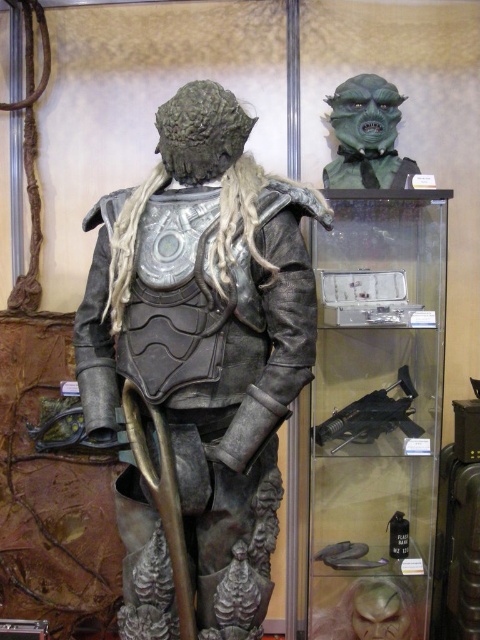
Question: Which point is closer to the camera?

Choices:
 (A) bronze armor at center
 (B) green matte mask at upper center

Answer: (A)

Question: Which point appears farthest from the camera in this image?

Choices:
 (A) (97, 236)
 (B) (406, 173)

Answer: (B)

Question: Is bronze armor at center positioned in front of green matte mask at upper center?

Choices:
 (A) no
 (B) yes

Answer: (B)

Question: Does bronze armor at center appear on the left side of green matte mask at upper center?

Choices:
 (A) yes
 (B) no

Answer: (A)

Question: Can you confirm if bronze armor at center is positioned above green matte mask at upper center?

Choices:
 (A) yes
 (B) no

Answer: (B)